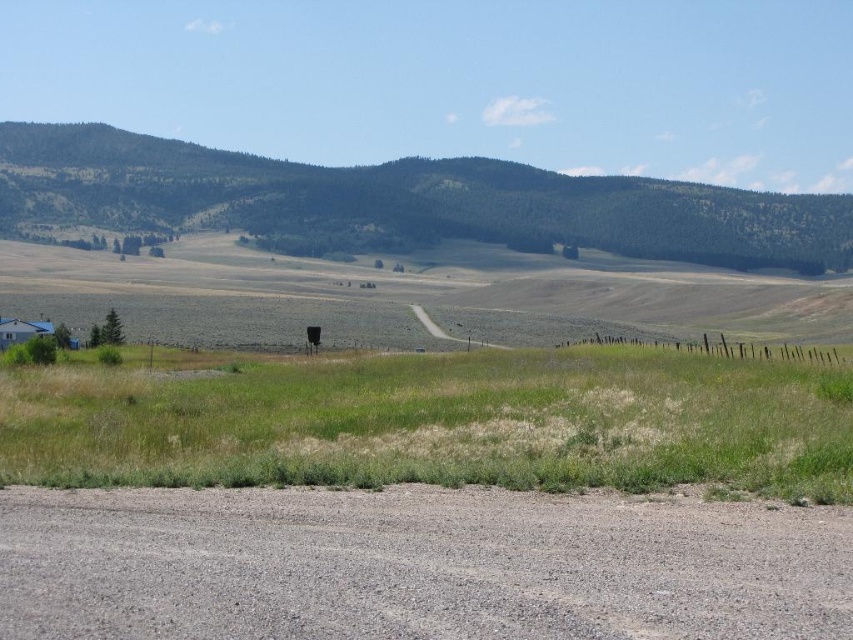
Question: Which of the following is the farthest from the observer?

Choices:
 (A) green grass at lower center
 (B) gray gravel dirt track at lower center
 (C) green forested mountain at upper center

Answer: (C)

Question: Is gray gravel dirt track at lower center to the right of green forested mountain at upper center from the viewer's perspective?

Choices:
 (A) yes
 (B) no

Answer: (A)

Question: Can you confirm if green grass at lower center is thinner than green forested mountain at upper center?

Choices:
 (A) no
 (B) yes

Answer: (B)

Question: Is gray gravel dirt track at lower center positioned before green forested mountain at upper center?

Choices:
 (A) yes
 (B) no

Answer: (A)

Question: Which object is the farthest from the green forested mountain at upper center?

Choices:
 (A) green grass at lower center
 (B) gray gravel dirt track at lower center

Answer: (B)

Question: Which object is closer to the camera taking this photo?

Choices:
 (A) green forested mountain at upper center
 (B) gray gravel dirt track at lower center
 (C) green grass at lower center

Answer: (B)